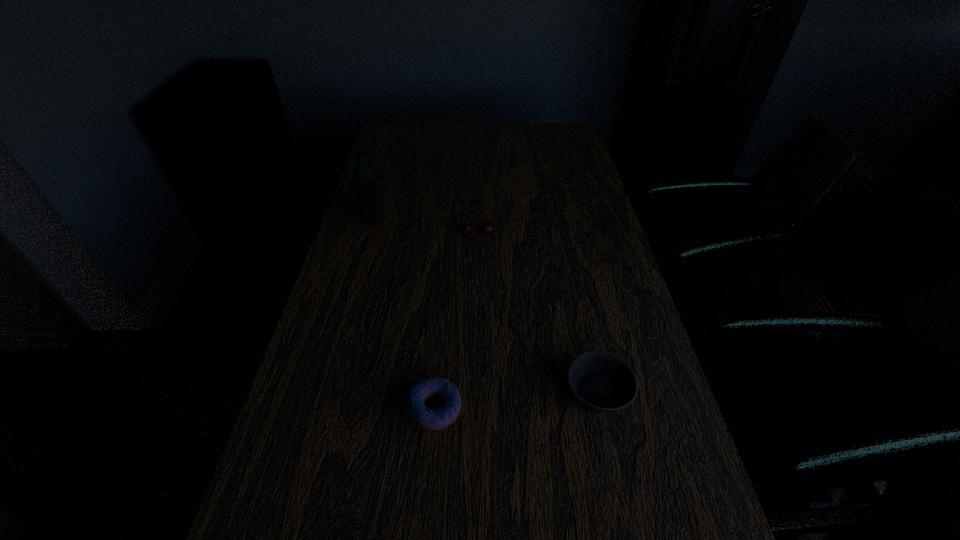
Locate an element on the screen. This screenshot has height=540, width=960. object that is at the left edge is located at coordinates (365, 176).

What are the coordinates of `object that is at the right edge` in the screenshot? It's located at (600, 381).

Identify the location of free region at the far edge. (531, 149).

You are a GUI agent. You are given a task and a screenshot of the screen. Output one action in this format:
    pyautogui.click(x=<x>, y=<y>)
    Task: Click on the vacant space at the left edge of the desktop
    
    Given the screenshot: What is the action you would take?
    pyautogui.click(x=397, y=159)

In the image, there is a desktop. In order to click on vacant space at the right edge in this screenshot , I will do `click(625, 278)`.

Locate an element on the screen. Image resolution: width=960 pixels, height=540 pixels. blank area at the far left corner is located at coordinates (400, 134).

Find the location of a particular element. The height and width of the screenshot is (540, 960). unoccupied position between the cherry and the farthest object is located at coordinates (426, 227).

Where is `free space between the doughnut and the rightmost object`? The width and height of the screenshot is (960, 540). free space between the doughnut and the rightmost object is located at coordinates (516, 400).

This screenshot has height=540, width=960. Identify the location of vacant area that lies between the cherry and the bowl. (538, 313).

Locate an element on the screen. This screenshot has width=960, height=540. free area in between the third shortest object and the rightmost object is located at coordinates (538, 313).